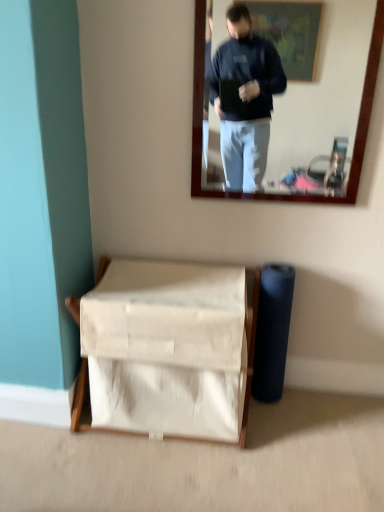
Question: From the image's perspective, is white fabric basket at lower center over matte wooden mirror at upper center?

Choices:
 (A) no
 (B) yes

Answer: (A)

Question: From a real-world perspective, is white fabric basket at lower center positioned under matte wooden mirror at upper center based on gravity?

Choices:
 (A) no
 (B) yes

Answer: (B)

Question: Can you confirm if white fabric basket at lower center is smaller than matte wooden mirror at upper center?

Choices:
 (A) yes
 (B) no

Answer: (B)

Question: Is white fabric basket at lower center positioned in front of matte wooden mirror at upper center?

Choices:
 (A) no
 (B) yes

Answer: (A)

Question: From a real-world perspective, is white fabric basket at lower center over matte wooden mirror at upper center?

Choices:
 (A) yes
 (B) no

Answer: (B)

Question: Is white fabric basket at lower center bigger than matte wooden mirror at upper center?

Choices:
 (A) yes
 (B) no

Answer: (A)

Question: Is matte wooden mirror at upper center positioned behind white fabric basket at lower center?

Choices:
 (A) no
 (B) yes

Answer: (A)

Question: Is matte wooden mirror at upper center turned away from white fabric basket at lower center?

Choices:
 (A) yes
 (B) no

Answer: (B)

Question: Are matte wooden mirror at upper center and white fabric basket at lower center located far from each other?

Choices:
 (A) yes
 (B) no

Answer: (A)

Question: Considering the relative positions of matte wooden mirror at upper center and white fabric basket at lower center in the image provided, is matte wooden mirror at upper center to the left of white fabric basket at lower center from the viewer's perspective?

Choices:
 (A) no
 (B) yes

Answer: (A)

Question: From the image's perspective, is matte wooden mirror at upper center located above white fabric basket at lower center?

Choices:
 (A) no
 (B) yes

Answer: (B)

Question: Can you confirm if matte wooden mirror at upper center is positioned to the right of white fabric basket at lower center?

Choices:
 (A) yes
 (B) no

Answer: (A)

Question: From their relative heights in the image, would you say white fabric basket at lower center is taller or shorter than matte wooden mirror at upper center?

Choices:
 (A) short
 (B) tall

Answer: (A)